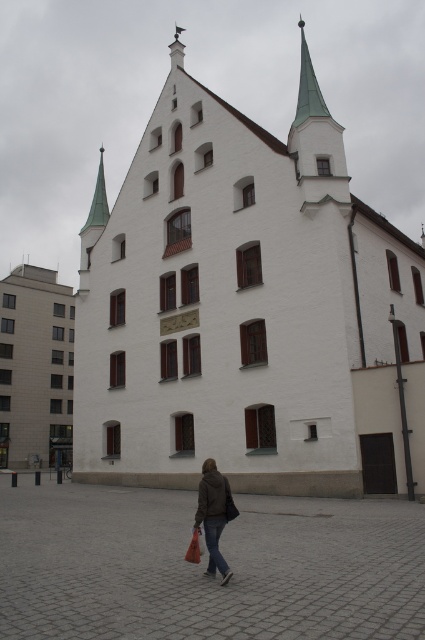
Is point (166, 545) positioned before point (210, 515)?

That is False.

Image resolution: width=425 pixels, height=640 pixels. Describe the element at coordinates (204, 564) in the screenshot. I see `gray cobblestone square at center` at that location.

Describe the element at coordinates (204, 564) in the screenshot. I see `gray cobblestone square at center` at that location.

This screenshot has height=640, width=425. I want to click on gray cobblestone square at center, so click(x=204, y=564).

Is point (62, 385) farther from viewer compared to point (218, 525)?

Yes.

Who is more forward, (34,403) or (229,573)?

Point (229,573)

Is point (3, 387) positioned behind point (215, 554)?

Yes, point (3, 387) is behind point (215, 554).

Locate an element on the screen. The height and width of the screenshot is (640, 425). white concrete building at left is located at coordinates (36, 369).

Is white stone church at center further to camera compared to white concrete building at left?

No, white stone church at center is closer to the viewer.

Does white stone church at center have a smaller size compared to white concrete building at left?

Incorrect, white stone church at center is not smaller in size than white concrete building at left.

Does point (357, 378) lie in front of point (59, 291)?

Yes, it is.

Identify the location of white stone church at center. This screenshot has width=425, height=640. (246, 308).